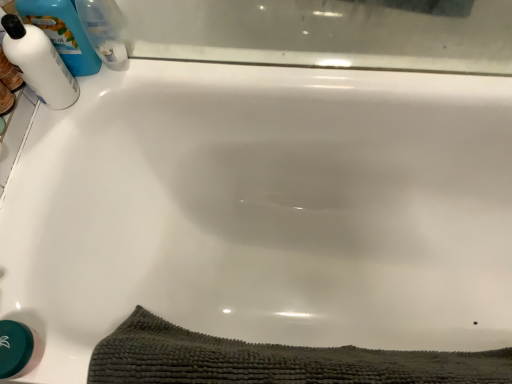
In order to click on free spot to the right of blue plastic bottle at upper left, which is counted as the first cleaning product, starting from the right in this screenshot , I will do `click(174, 66)`.